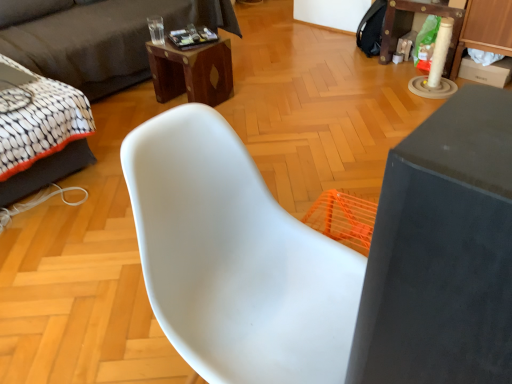
Where is `vacant region above matte gray table at right, which is the 2th table in top-to-bottom order (from a real-world perspective)`? Image resolution: width=512 pixels, height=384 pixels. vacant region above matte gray table at right, which is the 2th table in top-to-bottom order (from a real-world perspective) is located at coordinates (471, 129).